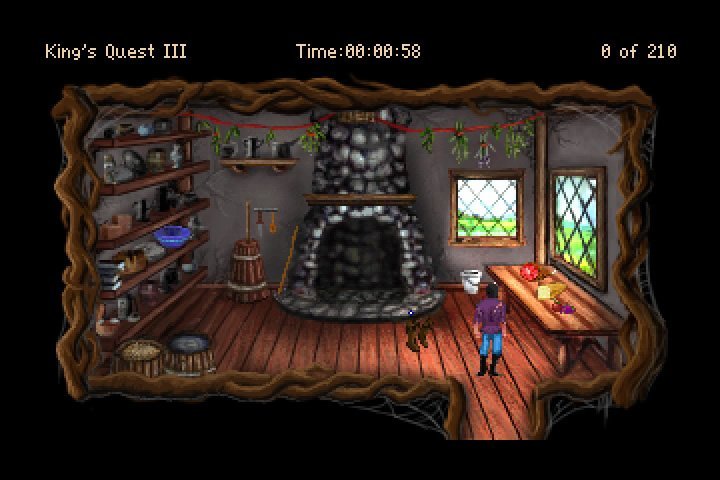
Image resolution: width=720 pixels, height=480 pixels. I want to click on wooden floor, so click(x=378, y=345).